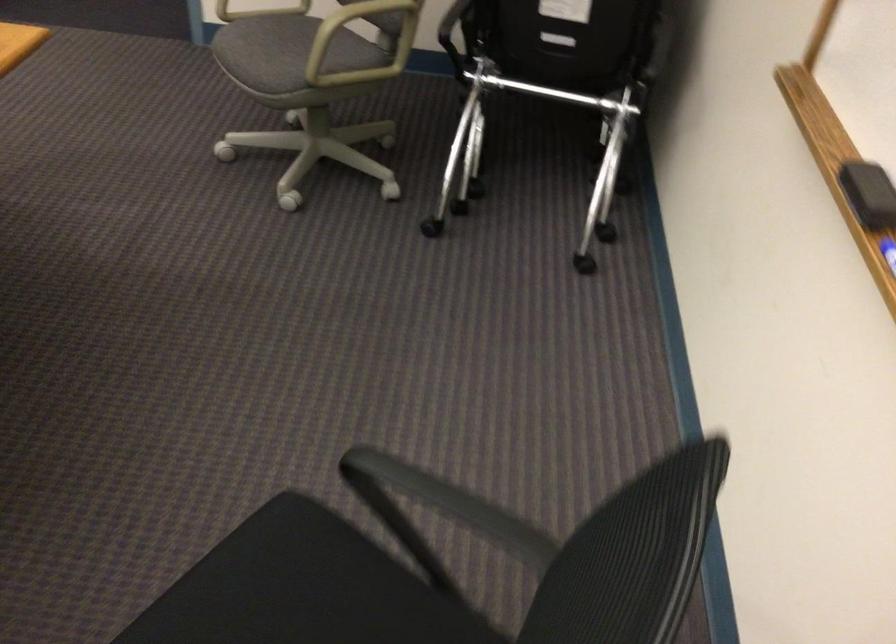
I want to click on gray chair sitting surface, so click(x=286, y=42).